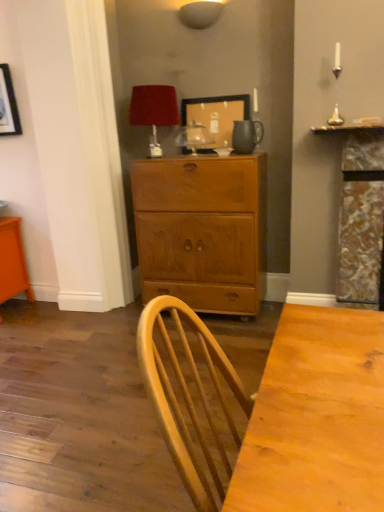
Question: Does velvet red lampshade at upper center, the 1th lamp in the bottom-to-top sequence, turn towards wooden picture frame at upper center?

Choices:
 (A) no
 (B) yes

Answer: (A)

Question: Can you confirm if velvet red lampshade at upper center, the second lamp in the top-to-bottom sequence, is smaller than wooden picture frame at upper center?

Choices:
 (A) yes
 (B) no

Answer: (B)

Question: Considering the relative sizes of velvet red lampshade at upper center, which ranks as the second lamp in right-to-left order, and wooden picture frame at upper center in the image provided, is velvet red lampshade at upper center, which ranks as the second lamp in right-to-left order, bigger than wooden picture frame at upper center?

Choices:
 (A) yes
 (B) no

Answer: (A)

Question: Are velvet red lampshade at upper center, the second lamp in the top-to-bottom sequence, and wooden picture frame at upper center far apart?

Choices:
 (A) yes
 (B) no

Answer: (B)

Question: Considering the relative positions of velvet red lampshade at upper center, the 1th lamp in the bottom-to-top sequence, and wooden picture frame at upper center in the image provided, is velvet red lampshade at upper center, the 1th lamp in the bottom-to-top sequence, to the right of wooden picture frame at upper center from the viewer's perspective?

Choices:
 (A) yes
 (B) no

Answer: (B)

Question: Is matte white lampshade at upper center, which appears as the second lamp when ordered from the bottom, situated inside matte brown pitcher at upper center or outside?

Choices:
 (A) outside
 (B) inside

Answer: (A)

Question: Visually, is matte white lampshade at upper center, which appears as the second lamp when ordered from the bottom, positioned to the left or to the right of matte brown pitcher at upper center?

Choices:
 (A) right
 (B) left

Answer: (B)

Question: Is matte white lampshade at upper center, which appears as the second lamp when ordered from the bottom, wider or thinner than matte brown pitcher at upper center?

Choices:
 (A) wide
 (B) thin

Answer: (A)

Question: Considering the positions of matte white lampshade at upper center, the 1th lamp when ordered from right to left, and matte brown pitcher at upper center in the image, is matte white lampshade at upper center, the 1th lamp when ordered from right to left, taller or shorter than matte brown pitcher at upper center?

Choices:
 (A) short
 (B) tall

Answer: (A)

Question: Looking at their shapes, would you say matte brown pitcher at upper center is wider or thinner than matte white lampshade at upper center, the first lamp viewed from the top?

Choices:
 (A) wide
 (B) thin

Answer: (B)

Question: Is point click(243, 131) positioned closer to the camera than point click(218, 9)?

Choices:
 (A) farther
 (B) closer

Answer: (B)

Question: From the image's perspective, relative to matte white lampshade at upper center, which appears as the second lamp when ordered from the bottom, is matte brown pitcher at upper center above or below?

Choices:
 (A) below
 (B) above

Answer: (A)

Question: Choose the correct answer: Is matte brown pitcher at upper center inside matte white lampshade at upper center, the first lamp viewed from the top, or outside it?

Choices:
 (A) outside
 (B) inside

Answer: (A)

Question: Is point (173, 96) positioned closer to the camera than point (195, 104)?

Choices:
 (A) closer
 (B) farther

Answer: (A)

Question: Considering the positions of velvet red lampshade at upper center, which ranks as the second lamp in right-to-left order, and wooden picture frame at upper center in the image, is velvet red lampshade at upper center, which ranks as the second lamp in right-to-left order, wider or thinner than wooden picture frame at upper center?

Choices:
 (A) wide
 (B) thin

Answer: (A)